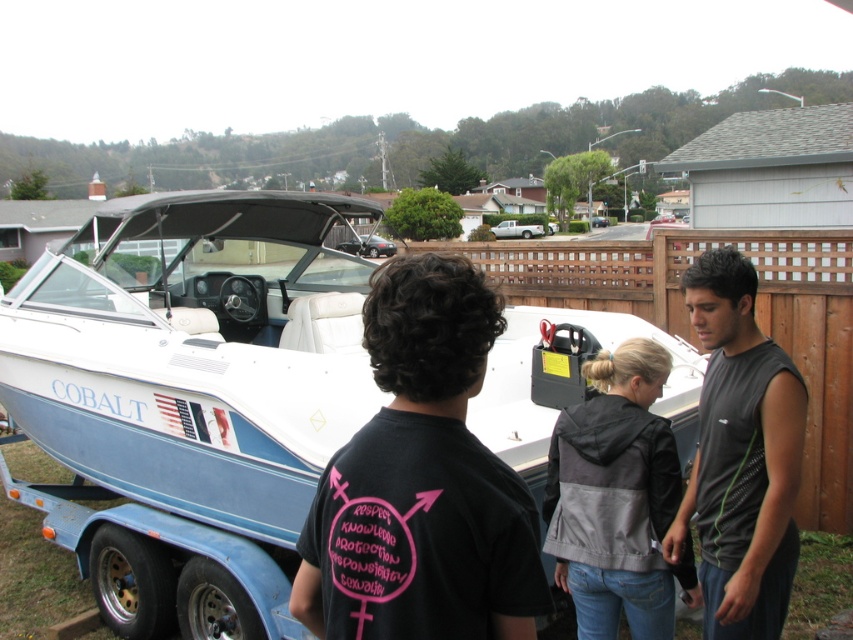
Question: Is white glossy boat at center wider than gray fabric jacket at center?

Choices:
 (A) no
 (B) yes

Answer: (B)

Question: In this image, where is white glossy boat at center located relative to black matte shirt at center?

Choices:
 (A) right
 (B) left

Answer: (B)

Question: Based on their relative distances, which object is nearer to the gray fabric jacket at center?

Choices:
 (A) white glossy boat at center
 (B) black sleeveless shirt at center
 (C) black matte shirt at center

Answer: (B)

Question: Which of the following is the farthest from the observer?

Choices:
 (A) (769, 368)
 (B) (122, 241)
 (C) (625, 616)
 (D) (497, 572)

Answer: (B)

Question: Which object is the farthest from the white glossy boat at center?

Choices:
 (A) gray fabric jacket at center
 (B) black sleeveless shirt at center

Answer: (B)

Question: Where is white glossy boat at center located in relation to gray fabric jacket at center in the image?

Choices:
 (A) right
 (B) left

Answer: (B)